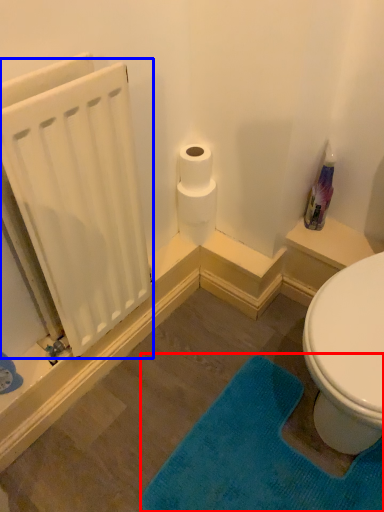
Question: Which of the following is the farthest to the observer, bath mat (highlighted by a red box) or radiator (highlighted by a blue box)?

Choices:
 (A) bath mat
 (B) radiator

Answer: (A)